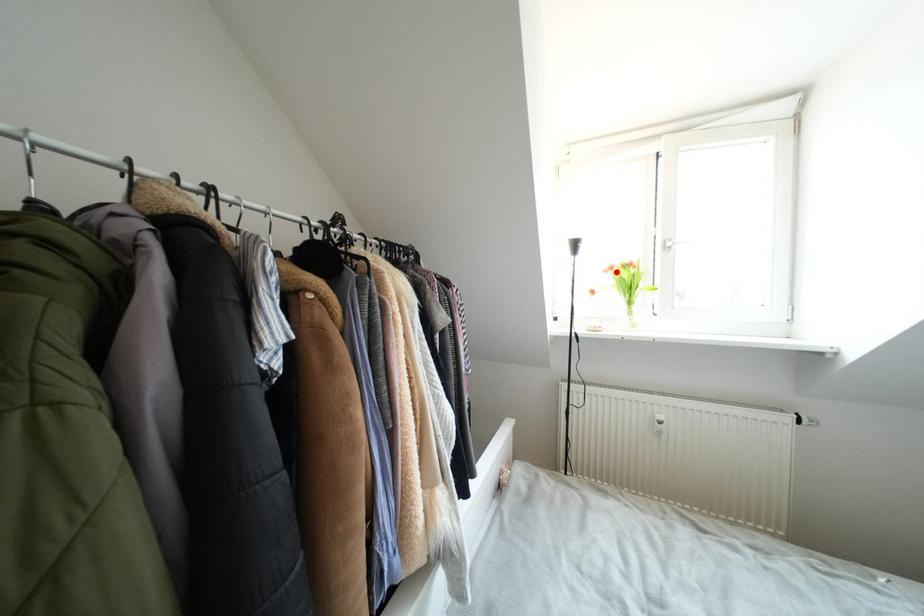
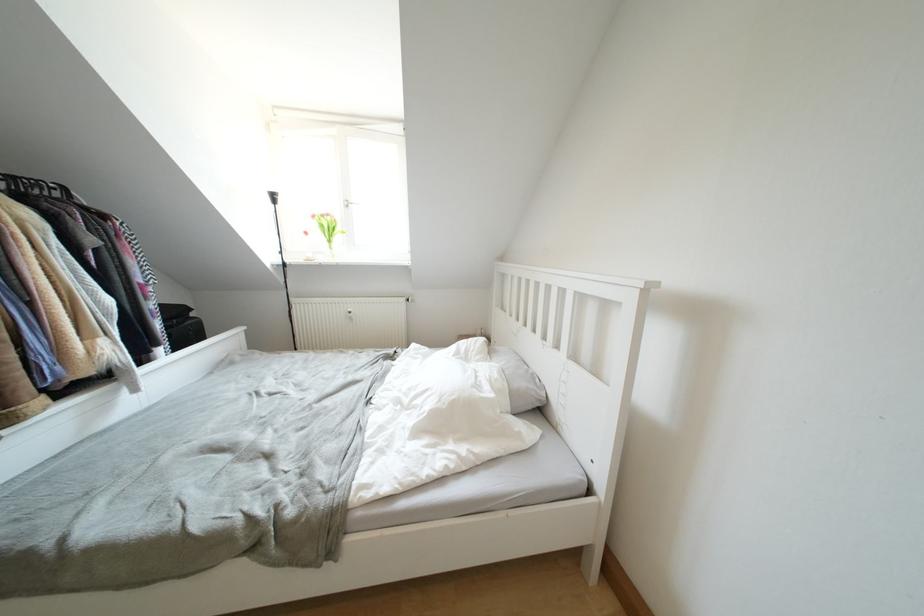
Find the pixel in the second image that matches the highlighted location in the first image.

(319, 220)